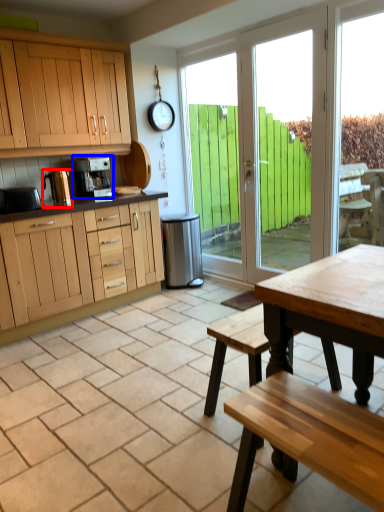
Question: Which of the following is the closest to the observer, appliance (highlighted by a red box) or coffee maker (highlighted by a blue box)?

Choices:
 (A) appliance
 (B) coffee maker

Answer: (A)